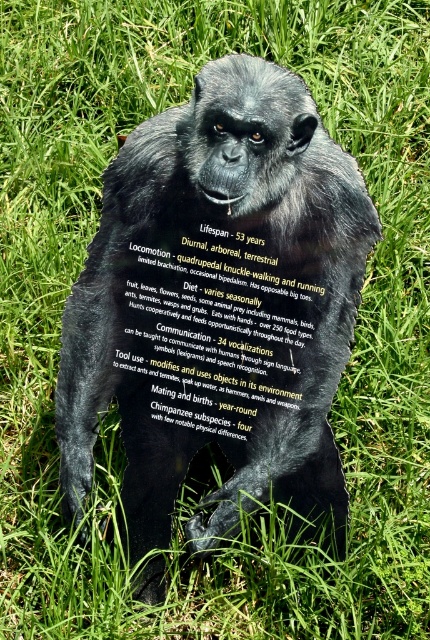
Is shiny black statue at center smaller than black plastic sign at center?

No.

Can you confirm if shiny black statue at center is positioned below black plastic sign at center?

Yes.

This screenshot has height=640, width=430. What are the coordinates of `shiny black statue at center` in the screenshot? It's located at (218, 305).

Find the location of `shiny black statue at center`. shiny black statue at center is located at coordinates (218, 305).